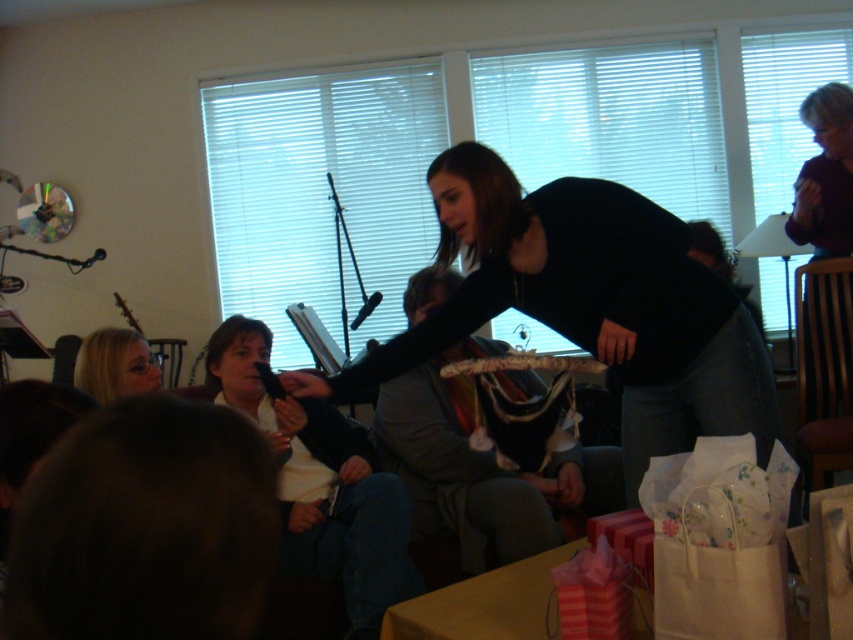
Who is shorter, black matte sweater at center or white matte shirt at center?

white matte shirt at center is shorter.

Does black matte sweater at center appear on the right side of white matte shirt at center?

Yes, black matte sweater at center is to the right of white matte shirt at center.

Measure the distance between black matte sweater at center and camera.

black matte sweater at center is 5.94 feet from camera.

I want to click on black matte sweater at center, so click(x=589, y=305).

Who is shorter, black matte sweater at center or gray fabric jacket at center?

With less height is gray fabric jacket at center.

This screenshot has height=640, width=853. I want to click on black matte sweater at center, so click(589, 305).

Measure the distance between black matte sweater at center and camera.

black matte sweater at center and camera are 1.81 meters apart from each other.

Identify the location of black matte sweater at center. (589, 305).

Which of these two, white matte shirt at center or blonde hair at lower left, stands shorter?

blonde hair at lower left

Which is below, white matte shirt at center or blonde hair at lower left?

Positioned lower is white matte shirt at center.

Is point (347, 488) positioned in front of point (109, 362)?

That is False.

I want to click on white matte shirt at center, so click(321, 483).